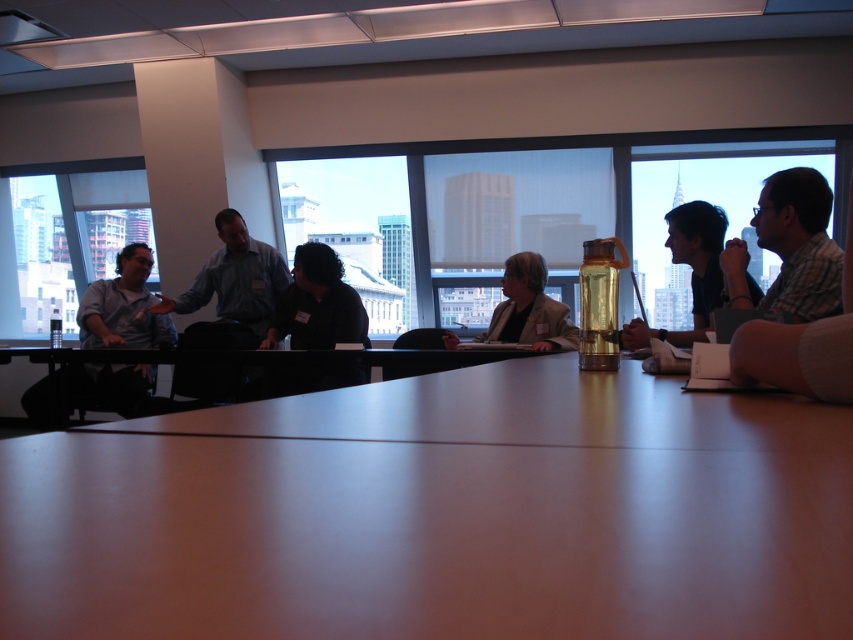
Question: Where is plaid shirt at right located in relation to translucent plastic water bottle at upper right in the image?

Choices:
 (A) above
 (B) below

Answer: (A)

Question: Can you confirm if plaid shirt at right is positioned to the left of matte gray shirt at left?

Choices:
 (A) yes
 (B) no

Answer: (B)

Question: Does light blue shirt at center have a lesser width compared to dark gray shirt at center?

Choices:
 (A) no
 (B) yes

Answer: (A)

Question: Which of the following is the closest to the observer?

Choices:
 (A) matte gray shirt at left
 (B) light blue shirt at center

Answer: (A)

Question: Which object is positioned closest to the matte gray shirt at left?

Choices:
 (A) light blue shirt at center
 (B) plaid shirt at right
 (C) translucent plastic water bottle at center

Answer: (A)

Question: Which of the following is the closest to the observer?

Choices:
 (A) (585, 314)
 (B) (552, 300)
 (C) (102, 333)

Answer: (A)